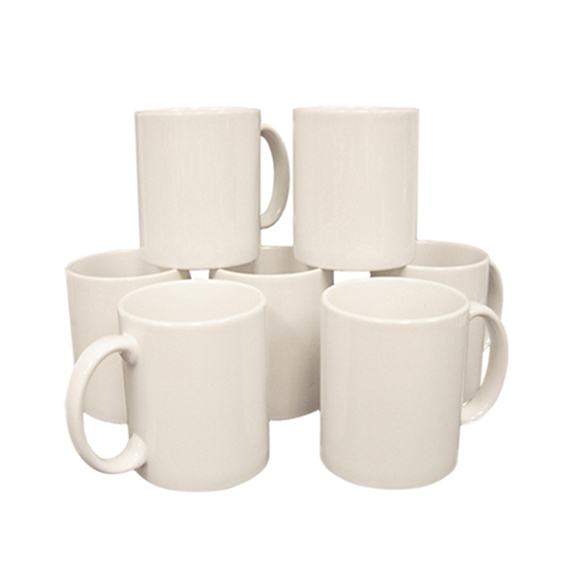
Where is `ceramic mugs`? ceramic mugs is located at coordinates (205, 192), (344, 171), (101, 317), (219, 385), (298, 352), (403, 377), (465, 287).